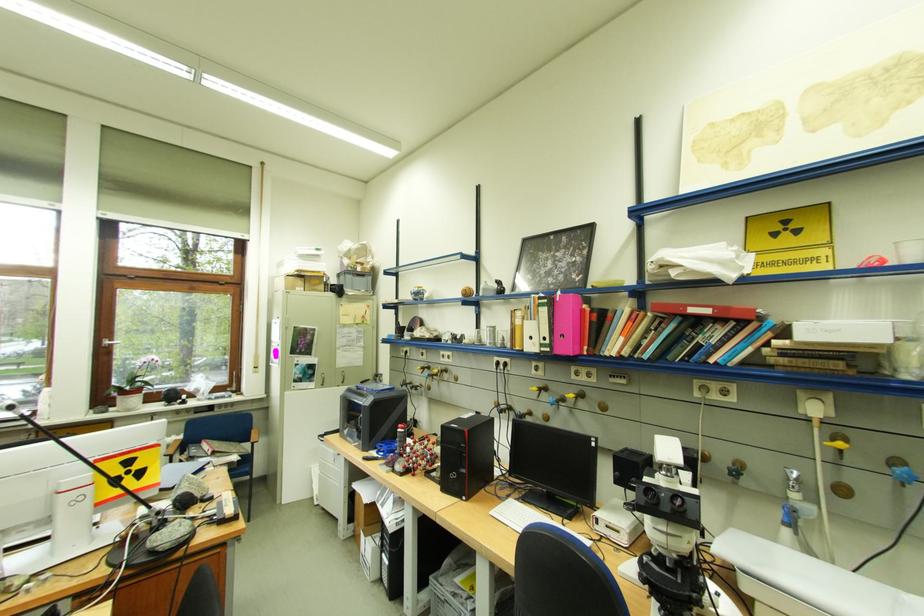
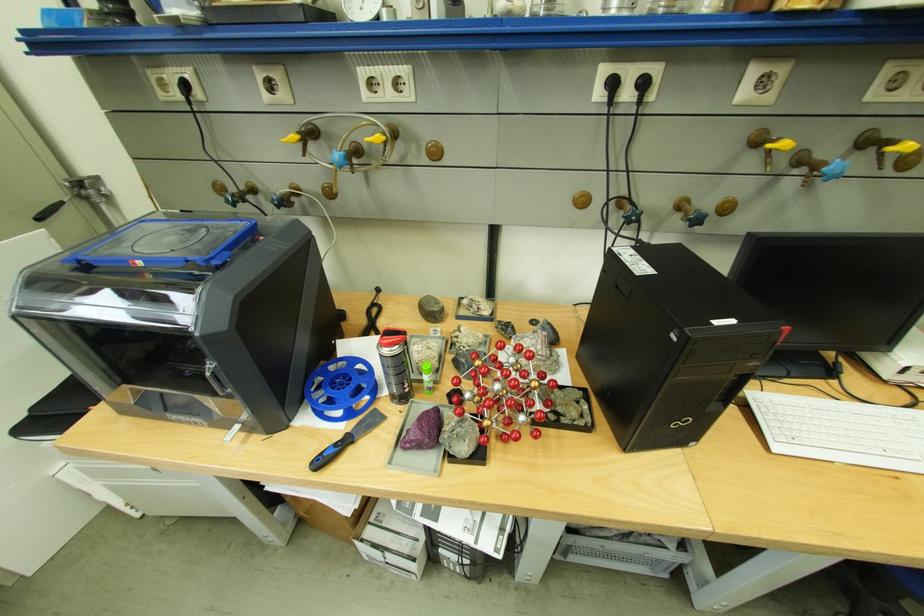
In the second image, find the point that corresponds to (x=408, y=468) in the first image.

(475, 448)